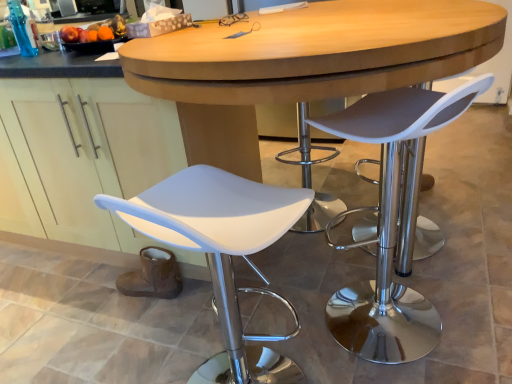
Question: Looking at their shapes, would you say matte gray seat at right, which is counted as the first chair, starting from the right, is wider or thinner than white matte chair at lower left, which is counted as the first chair, starting from the left?

Choices:
 (A) wide
 (B) thin

Answer: (B)

Question: In the image, is matte gray seat at right, which is counted as the first chair, starting from the right, positioned in front of or behind white matte chair at lower left, which is counted as the first chair, starting from the left?

Choices:
 (A) front
 (B) behind

Answer: (B)

Question: In terms of size, does matte gray seat at right, which is counted as the first chair, starting from the right, appear bigger or smaller than white matte chair at lower left, which is the 2th chair in right-to-left order?

Choices:
 (A) big
 (B) small

Answer: (A)

Question: Looking at their shapes, would you say white matte chair at lower left, which is the 2th chair in right-to-left order, is wider or thinner than matte gray seat at right, placed as the second chair when sorted from left to right?

Choices:
 (A) wide
 (B) thin

Answer: (A)

Question: Is white matte chair at lower left, which is counted as the first chair, starting from the left, taller or shorter than matte gray seat at right, placed as the second chair when sorted from left to right?

Choices:
 (A) tall
 (B) short

Answer: (B)

Question: From the image's perspective, is white matte chair at lower left, which is the 2th chair in right-to-left order, above or below matte gray seat at right, placed as the second chair when sorted from left to right?

Choices:
 (A) above
 (B) below

Answer: (B)

Question: Considering the positions of point [232, 367] and point [415, 157], is point [232, 367] closer or farther from the camera than point [415, 157]?

Choices:
 (A) closer
 (B) farther

Answer: (A)